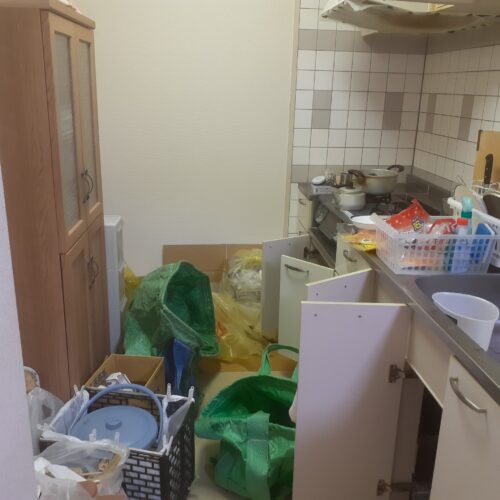
Find the location of a particular element. This screenshot has height=500, width=500. wall is located at coordinates (167, 115).